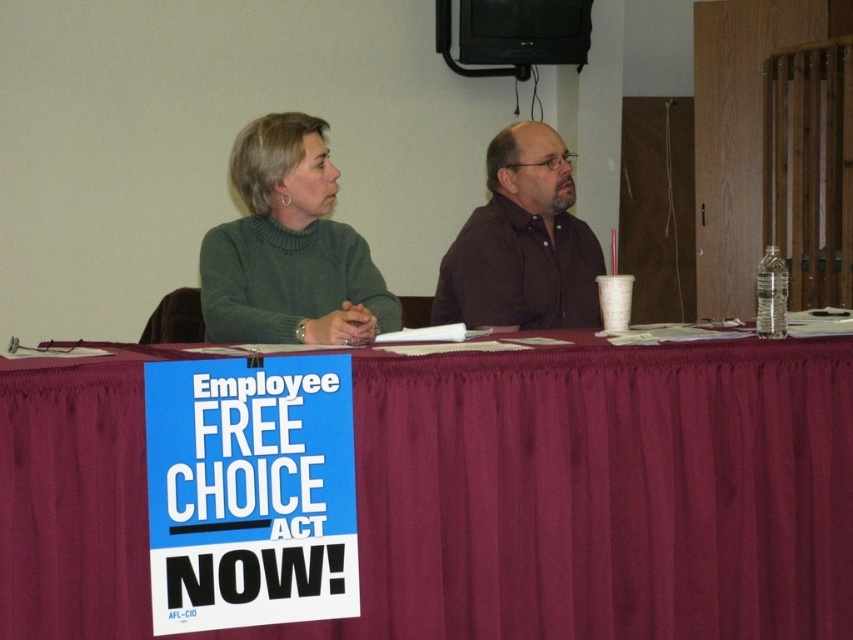
You are a photographer taking a picture of the green sweater at upper left and the brown matte shirt at center. Which one will appear larger in the photo?

The green sweater at upper left will appear larger in the photo because it is closer to the viewer than the brown matte shirt at center.

From the picture: You are an observer at the back of the room. You see the green sweater at upper left and the brown matte shirt at center. Which one appears wider from your perspective?

The brown matte shirt at center appears wider than the green sweater at upper left since the green sweater at upper left has a lesser width compared to brown matte shirt at center.

You are a photographer standing in front of the scene. You want to take a photo of the maroon fabric table at center and the brown matte shirt at center. Which object should you focus on first if you want to ensure both are in focus without changing the camera settings?

The maroon fabric table at center is taller than the brown matte shirt at center, so focusing on the maroon fabric table at center first will ensure both are in focus since it is farther away and has a larger depth of field.